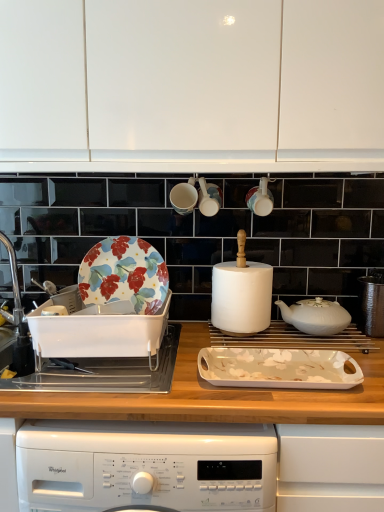
Question: Is point (344, 320) closer or farther from the camera than point (13, 361)?

Choices:
 (A) farther
 (B) closer

Answer: (A)

Question: In the image, is white ceramic teapot at center, positioned as the second kitchen appliance in front-to-back order, positioned in front of or behind silver metallic sink at left, which is the second sink in right-to-left order?

Choices:
 (A) behind
 (B) front

Answer: (B)

Question: Considering the real-world distances, which object is closest to the white matte cabinet at upper center?

Choices:
 (A) white plastic sink at left, the first sink positioned from the right
 (B) matte ceramic cup at upper center, the 1th appliance viewed from the right
 (C) white glossy cup at upper center, the third appliance positioned from the right
 (D) wooden at center
 (E) white glossy tray at center, which is counted as the first kitchen appliance, starting from the bottom

Answer: (C)

Question: Based on their relative distances, which object is nearer to the floral-patterned ceramic plate at left?

Choices:
 (A) silver metallic sink at left, which is counted as the 1th sink, starting from the left
 (B) white glossy cup at upper center, acting as the 1th appliance starting from the left
 (C) white matte paper towel at center
 (D) white glossy tray at center, acting as the 2th kitchen appliance starting from the back
 (E) matte ceramic cup at upper center, which is counted as the third appliance, starting from the left

Answer: (C)